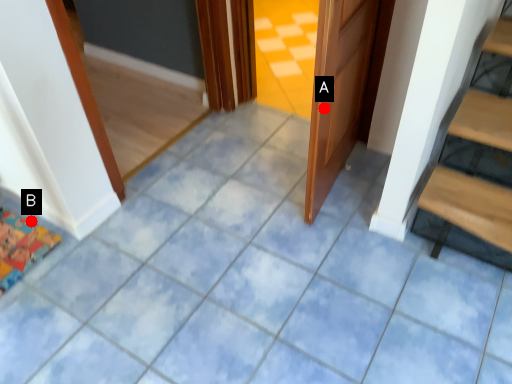
Question: Two points are circled on the image, labeled by A and B beside each circle. Which point is farther to the camera?

Choices:
 (A) A is further
 (B) B is further

Answer: (B)